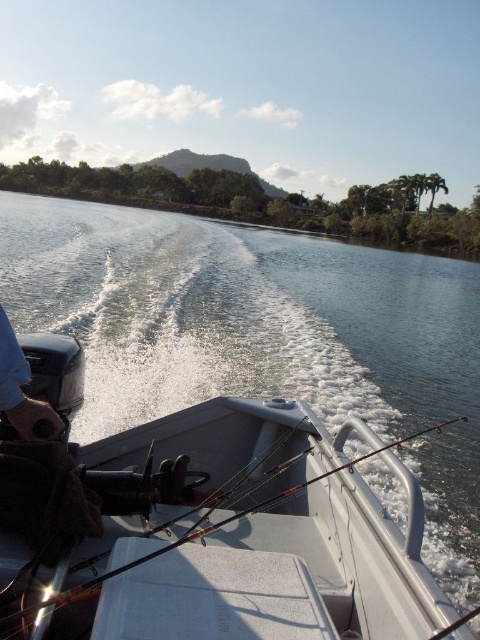
Question: Can you confirm if white plastic boat at center is positioned to the right of blue fabric glove at lower left?

Choices:
 (A) no
 (B) yes

Answer: (B)

Question: Which point appears farthest from the camera in this image?

Choices:
 (A) (355, 426)
 (B) (3, 392)

Answer: (A)

Question: Among these points, which one is nearest to the camera?

Choices:
 (A) (27, 372)
 (B) (287, 612)

Answer: (B)

Question: Which point appears closest to the camera in this image?

Choices:
 (A) (22, 413)
 (B) (342, 488)

Answer: (A)

Question: Is white plastic boat at center to the left of blue fabric glove at lower left from the viewer's perspective?

Choices:
 (A) no
 (B) yes

Answer: (A)

Question: Observing the image, what is the correct spatial positioning of white plastic boat at center in reference to blue fabric glove at lower left?

Choices:
 (A) left
 (B) right

Answer: (B)